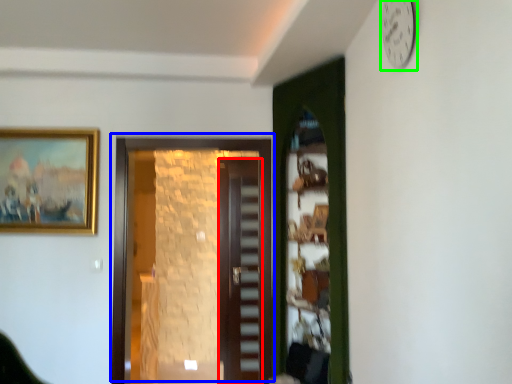
Question: Estimate the real-world distances between objects in this image. Which object is closer to door (highlighted by a red box), door (highlighted by a blue box) or clock (highlighted by a green box)?

Choices:
 (A) door
 (B) clock

Answer: (A)